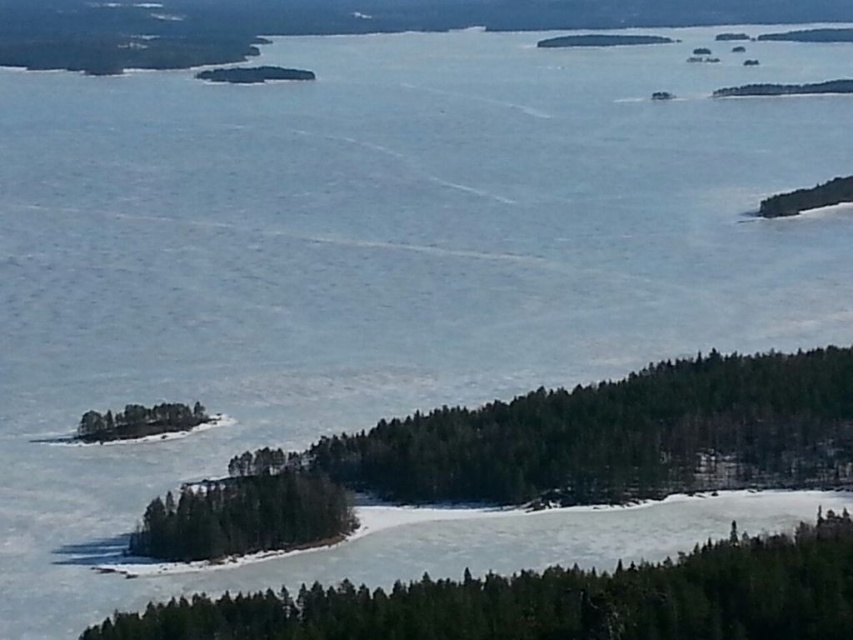
You are standing at a viewpoint overlooking the lake and see two points marked on the image. The first point is labeled as point (151, 508) and the second is point (149, 410). Which of these two points is closer to your current position?

Point (151, 508) is closer to the viewer than point (149, 410), so the first point is closer to your current position.

You are standing on the frozen lake and see the green matte tree at lower center and the green matte island at lower left. Which one is wider?

The green matte tree at lower center is wider than the green matte island at lower left.

You are standing at the edge of the lake in the image and notice a point marked at coordinates (552, 600). Which object in the scene does this point most likely indicate?

The point at coordinates (552, 600) corresponds to the green matte tree at lower center.